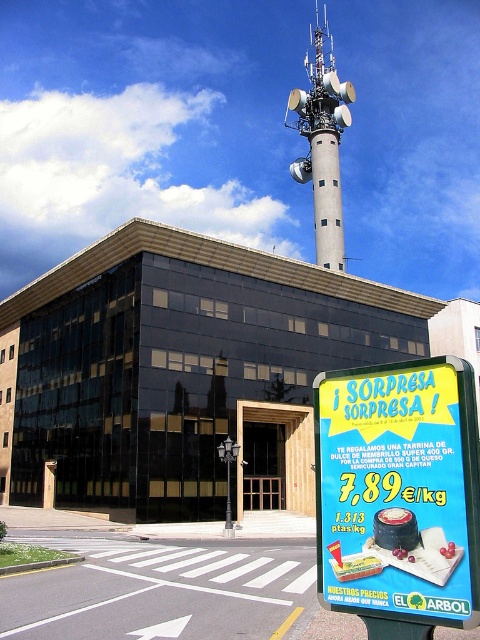
Is point (297, 90) positioned before point (230, 520)?

No, (297, 90) is further to viewer.

Which is more to the right, gray concrete tower at upper center or metallic pole at center?

Positioned to the right is gray concrete tower at upper center.

Image resolution: width=480 pixels, height=640 pixels. Describe the element at coordinates (323, 141) in the screenshot. I see `gray concrete tower at upper center` at that location.

Find the location of a particular element. Image resolution: width=480 pixels, height=640 pixels. gray concrete tower at upper center is located at coordinates (323, 141).

Between point (336, 499) and point (228, 506), which one is positioned in front?

Positioned in front is point (336, 499).

Does yellow paper sign at lower right have a greater height compared to metallic pole at center?

No.

Where is `yellow paper sign at lower right`? This screenshot has width=480, height=640. yellow paper sign at lower right is located at coordinates (398, 496).

Can you confirm if gray concrete tower at upper center is bigger than metallic streetlight at center?

Correct, gray concrete tower at upper center is larger in size than metallic streetlight at center.

Is gray concrete tower at upper center further to the viewer compared to metallic streetlight at center?

That is True.

Which is behind, point (310, 99) or point (229, 474)?

The point (310, 99) is more distant.

Locate an element on the screen. gray concrete tower at upper center is located at coordinates (323, 141).